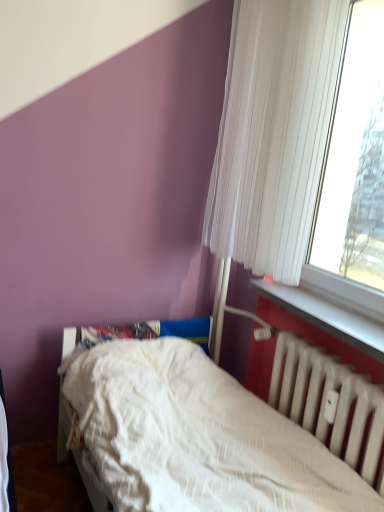
Question: Can you confirm if white pleated curtain at upper right is wider than white plastic window sill at lower right?

Choices:
 (A) no
 (B) yes

Answer: (B)

Question: From the image's perspective, is white pleated curtain at upper right under white plastic window sill at lower right?

Choices:
 (A) yes
 (B) no

Answer: (B)

Question: From a real-world perspective, is white pleated curtain at upper right under white plastic window sill at lower right?

Choices:
 (A) no
 (B) yes

Answer: (A)

Question: Could you tell me if white pleated curtain at upper right is turned towards white plastic window sill at lower right?

Choices:
 (A) no
 (B) yes

Answer: (A)

Question: From the image's perspective, is white pleated curtain at upper right on top of white plastic window sill at lower right?

Choices:
 (A) yes
 (B) no

Answer: (A)

Question: Are white pleated curtain at upper right and white plastic window sill at lower right making contact?

Choices:
 (A) no
 (B) yes

Answer: (A)

Question: Is white textured bed at lower center closer to the viewer compared to white matte radiator at lower right?

Choices:
 (A) no
 (B) yes

Answer: (B)

Question: Can white matte radiator at lower right be found inside white textured bed at lower center?

Choices:
 (A) no
 (B) yes

Answer: (B)

Question: From a real-world perspective, is white textured bed at lower center positioned under white matte radiator at lower right based on gravity?

Choices:
 (A) no
 (B) yes

Answer: (B)

Question: Is white textured bed at lower center far from white matte radiator at lower right?

Choices:
 (A) no
 (B) yes

Answer: (A)

Question: Is white textured bed at lower center oriented away from white matte radiator at lower right?

Choices:
 (A) yes
 (B) no

Answer: (B)

Question: Considering the relative positions of white textured bed at lower center and white matte radiator at lower right in the image provided, is white textured bed at lower center to the left of white matte radiator at lower right from the viewer's perspective?

Choices:
 (A) yes
 (B) no

Answer: (A)

Question: From the image's perspective, is white pleated curtain at upper right below white textured bed at lower center?

Choices:
 (A) yes
 (B) no

Answer: (B)